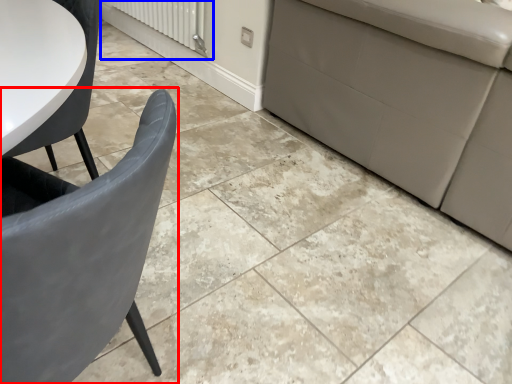
Question: Which point is closer to the camera, chair (highlighted by a red box) or radiator (highlighted by a blue box)?

Choices:
 (A) chair
 (B) radiator

Answer: (A)